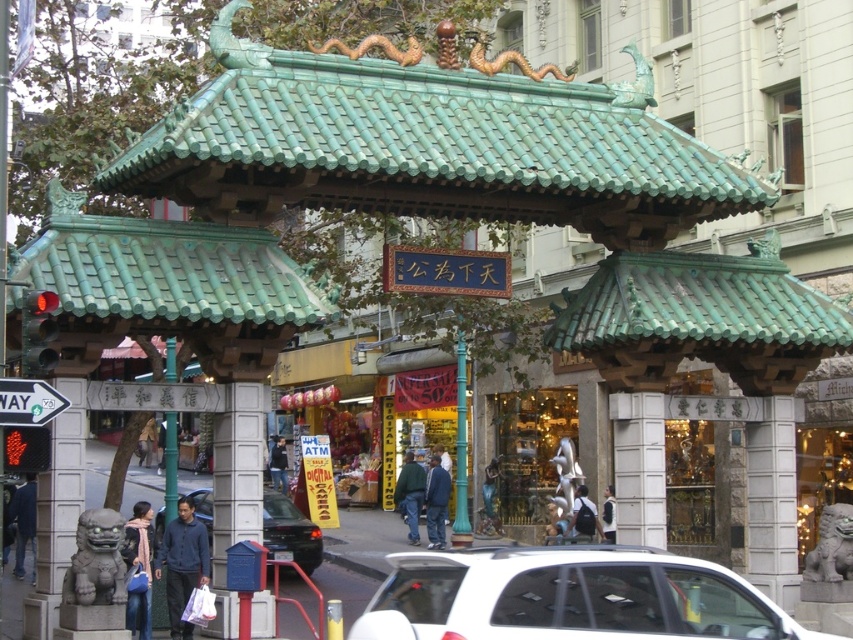
You are standing in front of the traditional Chinese gate and notice a person wearing a dark blue shirt at center. Where exactly is the dark blue shirt located in relation to the gate?

The dark blue shirt at center is located at point coordinates of 0.808 on the x and 0.685 on the y axis.

You are standing in front of the traditional Chinese gate and notice two items. One is the white plastic street sign at upper left and the other is the blue denim jacket at lower left. Which of these two items is taller?

The blue denim jacket at lower left is taller than the white plastic street sign at upper left.